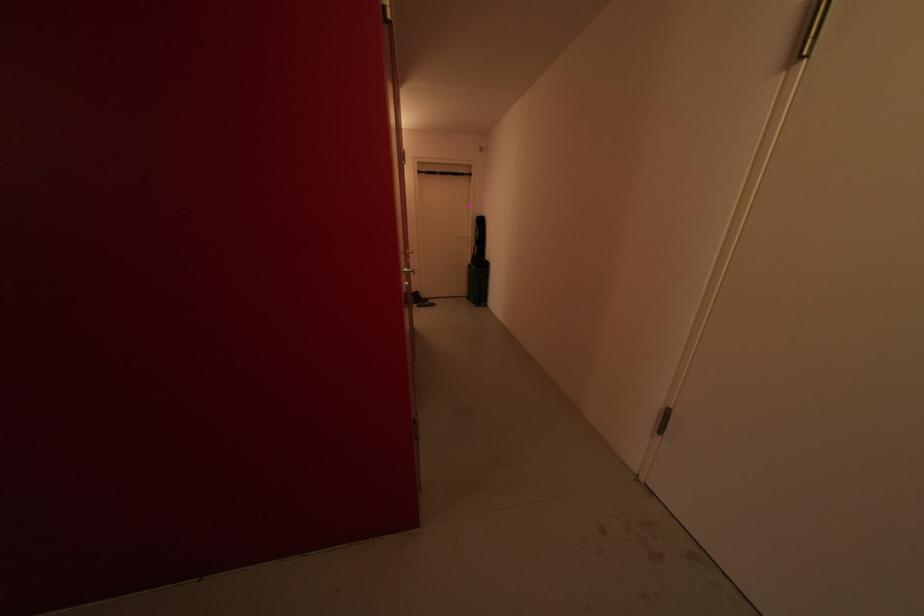
Where would you pull the doorway pull-up bar? Please return your answer as a coordinate pair (x, y).

(443, 228)